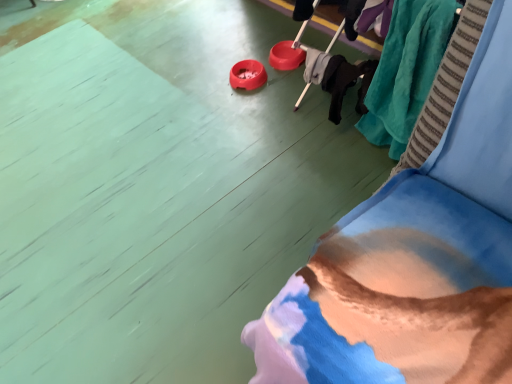
Find the location of a particular element. This screenshot has width=512, height=384. free spot to the left of teal plush blanket at upper right is located at coordinates (323, 177).